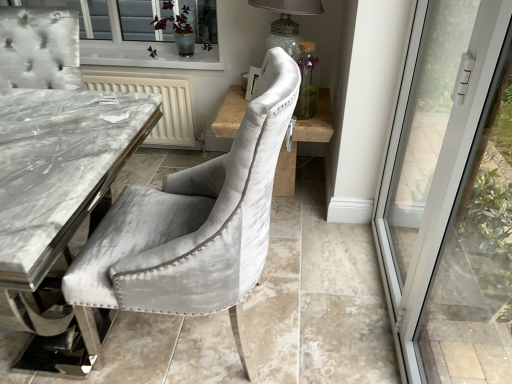
Locate an element on the screen. The height and width of the screenshot is (384, 512). vacant area on the back side of transparent glass door at right is located at coordinates (333, 260).